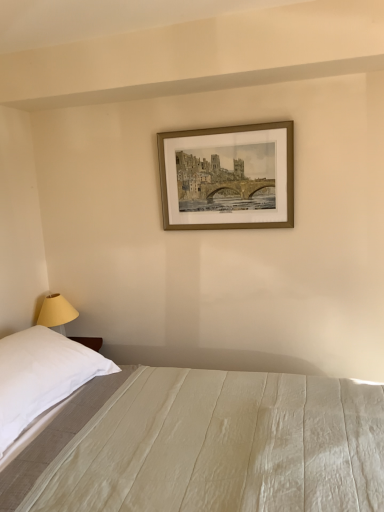
Question: From the image's perspective, is white cotton bed at lower center on top of gold metallic picture frame at upper center?

Choices:
 (A) no
 (B) yes

Answer: (A)

Question: Is gold metallic picture frame at upper center located within white cotton bed at lower center?

Choices:
 (A) no
 (B) yes

Answer: (A)

Question: Can you confirm if white cotton bed at lower center is shorter than gold metallic picture frame at upper center?

Choices:
 (A) yes
 (B) no

Answer: (B)

Question: From a real-world perspective, is white cotton bed at lower center positioned under gold metallic picture frame at upper center based on gravity?

Choices:
 (A) no
 (B) yes

Answer: (B)

Question: Does white cotton bed at lower center have a greater height compared to gold metallic picture frame at upper center?

Choices:
 (A) no
 (B) yes

Answer: (B)

Question: Based on their positions, is gold metallic picture frame at upper center located to the left or right of white cotton bed at lower center?

Choices:
 (A) right
 (B) left

Answer: (A)

Question: Based on their sizes in the image, would you say gold metallic picture frame at upper center is bigger or smaller than white cotton bed at lower center?

Choices:
 (A) big
 (B) small

Answer: (B)

Question: From a real-world perspective, relative to white cotton bed at lower center, is gold metallic picture frame at upper center vertically above or below?

Choices:
 (A) above
 (B) below

Answer: (A)

Question: Do you think gold metallic picture frame at upper center is within white cotton bed at lower center, or outside of it?

Choices:
 (A) inside
 (B) outside

Answer: (B)

Question: Would you say white soft pillow at left is to the left or to the right of white cotton bed at lower center in the picture?

Choices:
 (A) right
 (B) left

Answer: (B)

Question: In the image, is white soft pillow at left positioned in front of or behind white cotton bed at lower center?

Choices:
 (A) behind
 (B) front

Answer: (A)

Question: Is white soft pillow at left wider or thinner than white cotton bed at lower center?

Choices:
 (A) thin
 (B) wide

Answer: (A)

Question: In terms of size, does white soft pillow at left appear bigger or smaller than white cotton bed at lower center?

Choices:
 (A) big
 (B) small

Answer: (B)

Question: From a real-world perspective, is white cotton bed at lower center physically located above or below white soft pillow at left?

Choices:
 (A) above
 (B) below

Answer: (B)

Question: In terms of height, does white cotton bed at lower center look taller or shorter compared to white soft pillow at left?

Choices:
 (A) short
 (B) tall

Answer: (B)